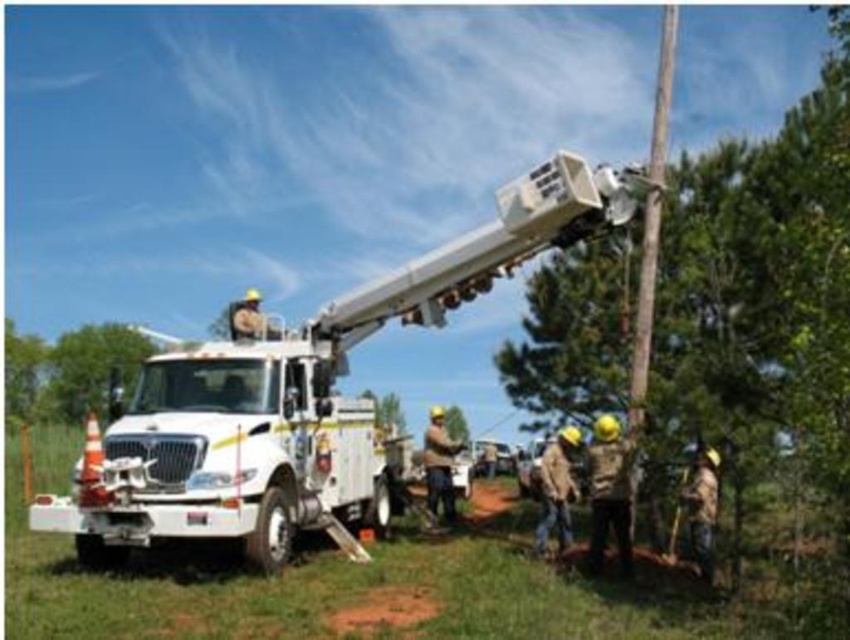
You are a safety inspector checking the work site. You notice the green leafy tree at left and the brown leather gloves at center. Which object is taller?

The green leafy tree at left is taller than the brown leather gloves at center.

You are a utility worker standing near the white utility truck and need to reach the utility pole. Which tree is closer to you between the green textured tree at center and the green leafy tree at left?

The green textured tree at center is closer to the viewer than the green leafy tree at left, so the green textured tree at center is closer to you.

You are a pedestrian standing on the sidewalk. You see a green leafy tree at left and brown leather gloves at center. Which object is closer to your left side?

The green leafy tree at left is closer to your left side since it is positioned to the left of the brown leather gloves at center.